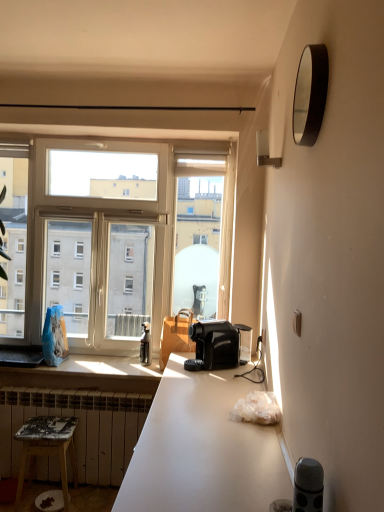
What do you see at coordinates (215, 344) in the screenshot?
I see `black plastic coffee machine at center` at bounding box center [215, 344].

Locate an element on the screen. This screenshot has width=384, height=512. wooden stool at lower left is located at coordinates (48, 447).

What do you see at coordinates (308, 486) in the screenshot?
I see `black matte speaker at lower right` at bounding box center [308, 486].

The width and height of the screenshot is (384, 512). Describe the element at coordinates (175, 335) in the screenshot. I see `brown leather handbag at window` at that location.

The height and width of the screenshot is (512, 384). Find the location of `white frosted glass wall sconce at upper right`. white frosted glass wall sconce at upper right is located at coordinates (265, 151).

This screenshot has width=384, height=512. Find the location of `matte black spray can at window`. matte black spray can at window is located at coordinates (145, 345).

Is matte black spray can at window behind brown leather handbag at window?

Yes, matte black spray can at window is behind brown leather handbag at window.

Is matte black spray can at window bigger than brown leather handbag at window?

No, matte black spray can at window is not bigger than brown leather handbag at window.

Is matte black spray can at window facing away from brown leather handbag at window?

No, matte black spray can at window's orientation is not away from brown leather handbag at window.

Can you confirm if matte black spray can at window is taller than brown leather handbag at window?

No.

Could you tell me if brown leather handbag at window is facing black glossy mirror at upper right?

No, brown leather handbag at window is not turned towards black glossy mirror at upper right.

Is brown leather handbag at window placed right next to black glossy mirror at upper right?

There is a gap between brown leather handbag at window and black glossy mirror at upper right.

From a real-world perspective, which is physically below, brown leather handbag at window or black glossy mirror at upper right?

brown leather handbag at window.

Which point is more distant from viewer, (160,347) or (308,116)?

The point (160,347) is more distant.

Between black glossy mirror at upper right and clear glass window at center, which one has less height?

black glossy mirror at upper right.

From the image's perspective, which is below, black glossy mirror at upper right or clear glass window at center?

clear glass window at center is shown below in the image.

From a real-world perspective, is black glossy mirror at upper right physically below clear glass window at center?

No, from a real-world perspective, black glossy mirror at upper right is not beneath clear glass window at center.

Is point (311, 88) behind point (131, 169)?

No, (311, 88) is in front of (131, 169).

Between black glossy mirror at upper right and brown leather handbag at window, which one has less height?

With less height is black glossy mirror at upper right.

Based on the photo, how distant is black glossy mirror at upper right from brown leather handbag at window?

A distance of 1.58 meters exists between black glossy mirror at upper right and brown leather handbag at window.

Find the location of a particular element. The width and height of the screenshot is (384, 512). mirror in front of the brown leather handbag at window is located at coordinates (310, 94).

Is black glossy mirror at upper right far away from brown leather handbag at window?

Yes, black glossy mirror at upper right and brown leather handbag at window are located far from each other.

Looking at their sizes, would you say wooden stool at lower left is wider or thinner than black plastic coffee machine at center?

In the image, wooden stool at lower left appears to be more narrow than black plastic coffee machine at center.

Measure the distance between wooden stool at lower left and black plastic coffee machine at center.

The distance of wooden stool at lower left from black plastic coffee machine at center is 3.36 feet.

Is wooden stool at lower left next to black plastic coffee machine at center?

They are not placed beside each other.

Which of these two, wooden stool at lower left or black plastic coffee machine at center, is smaller?

Smaller between the two is black plastic coffee machine at center.

Does brown leather handbag at window turn towards white frosted glass wall sconce at upper right?

No, brown leather handbag at window is not turned towards white frosted glass wall sconce at upper right.

Which is more to the left, brown leather handbag at window or white frosted glass wall sconce at upper right?

brown leather handbag at window.

What's the angular difference between brown leather handbag at window and white frosted glass wall sconce at upper right's facing directions?

83.9 degrees separate the facing orientations of brown leather handbag at window and white frosted glass wall sconce at upper right.

Image resolution: width=384 pixels, height=512 pixels. What are the coordinates of `lamp to the right of brown leather handbag at window` in the screenshot? It's located at (265, 151).

From the image's perspective, is clear glass window at center beneath white painted metal radiator at lower left?

Incorrect, from the image's perspective, clear glass window at center is higher than white painted metal radiator at lower left.

Can you confirm if clear glass window at center is smaller than white painted metal radiator at lower left?

Actually, clear glass window at center might be larger than white painted metal radiator at lower left.

Where is `handbag on the right of matte black spray can at window`? handbag on the right of matte black spray can at window is located at coordinates (175, 335).

Identify the location of handbag located below the black glossy mirror at upper right (from the image's perspective). (175, 335).

Estimate the real-world distances between objects in this image. Which object is closer to black plastic coffee machine at center, brown leather handbag at window or white frosted glass wall sconce at upper right?

brown leather handbag at window is positioned closer to the anchor black plastic coffee machine at center.

Estimate the real-world distances between objects in this image. Which object is closer to clear glass window at center, black matte speaker at lower right or matte black spray can at window?

matte black spray can at window is positioned closer to the anchor clear glass window at center.

Which object lies nearer to the anchor point black glossy mirror at upper right, black matte speaker at lower right or clear glass window at center?

black matte speaker at lower right.

Which object lies nearer to the anchor point matte black spray can at window, white painted metal radiator at lower left or brown leather handbag at window?

brown leather handbag at window is positioned closer to the anchor matte black spray can at window.

Considering their positions, is black matte speaker at lower right positioned closer to brown leather handbag at window than white painted metal radiator at lower left?

Among the two, white painted metal radiator at lower left is located nearer to brown leather handbag at window.

Looking at the image, which one is located further to wooden stool at lower left, black matte speaker at lower right or white painted metal radiator at lower left?

black matte speaker at lower right.

Which object lies nearer to the anchor point white frosted glass wall sconce at upper right, black plastic coffee machine at center or white painted metal radiator at lower left?

Among the two, black plastic coffee machine at center is located nearer to white frosted glass wall sconce at upper right.

Estimate the real-world distances between objects in this image. Which object is closer to clear glass window at center, white painted metal radiator at lower left or matte black spray can at window?

Among the two, matte black spray can at window is located nearer to clear glass window at center.

The image size is (384, 512). Find the location of `handbag between clear glass window at center and wooden stool at lower left vertically`. handbag between clear glass window at center and wooden stool at lower left vertically is located at coordinates (175, 335).

Where is `stool positioned between black matte speaker at lower right and brown leather handbag at window from near to far`? Image resolution: width=384 pixels, height=512 pixels. stool positioned between black matte speaker at lower right and brown leather handbag at window from near to far is located at coordinates (48, 447).

The height and width of the screenshot is (512, 384). What are the coordinates of `coffee machine that lies between clear glass window at center and white painted metal radiator at lower left from top to bottom` in the screenshot? It's located at (215, 344).

Locate an element on the screen. The height and width of the screenshot is (512, 384). coffee machine between white frosted glass wall sconce at upper right and white painted metal radiator at lower left from top to bottom is located at coordinates (215, 344).